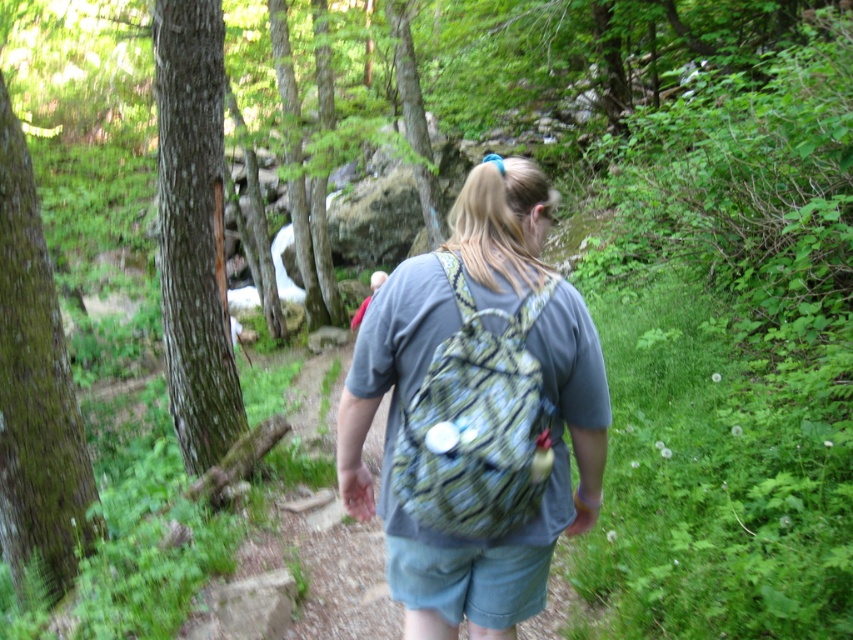
You are a hiker who just arrived at the forest path. You have two backpacks with you, the printed fabric backpack at center and the camouflage fabric backpack at center. Which one is positioned lower on your back?

The printed fabric backpack at center is located below the camouflage fabric backpack at center, so the printed fabric backpack at center is positioned lower on your back.

You are a hiker preparing for a trip and notice two backpacks in your inventory. You see a printed fabric backpack at center and a camouflage fabric backpack at center. Which one is taller?

The printed fabric backpack at center is taller than the camouflage fabric backpack at center.